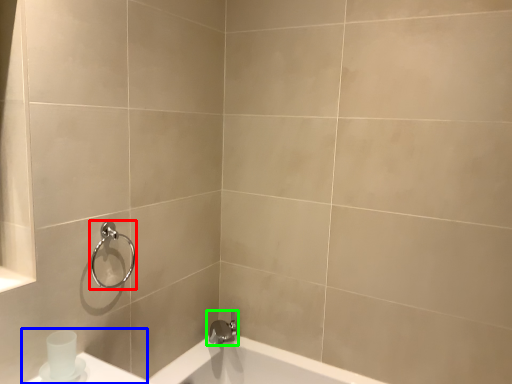
Question: Based on their relative distances, which object is nearer to shower (highlighted by a red box)? Choose from sink (highlighted by a blue box) and tap (highlighted by a green box).

Choices:
 (A) sink
 (B) tap

Answer: (A)